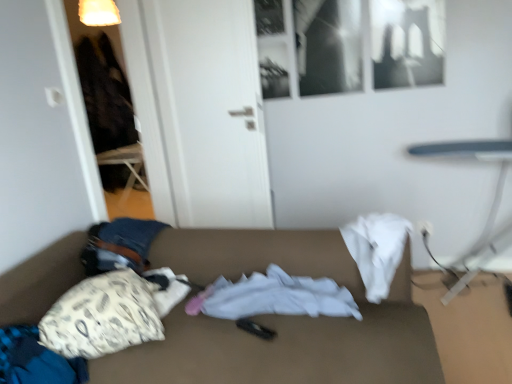
Question: Looking at their shapes, would you say white fabric at center is wider or thinner than white fabric couch at center?

Choices:
 (A) wide
 (B) thin

Answer: (B)

Question: Is point (292, 279) positioned closer to the camera than point (325, 375)?

Choices:
 (A) closer
 (B) farther

Answer: (B)

Question: Considering the real-world distances, which object is farthest from the white fabric pillow at lower left?

Choices:
 (A) white glossy door at center
 (B) white fabric couch at center
 (C) white fabric at center
 (D) smooth white table at right

Answer: (D)

Question: Which object is positioned farthest from the white fabric pillow at lower left?

Choices:
 (A) white fabric at center
 (B) white glossy door at center
 (C) white fabric couch at center
 (D) smooth white table at right

Answer: (D)